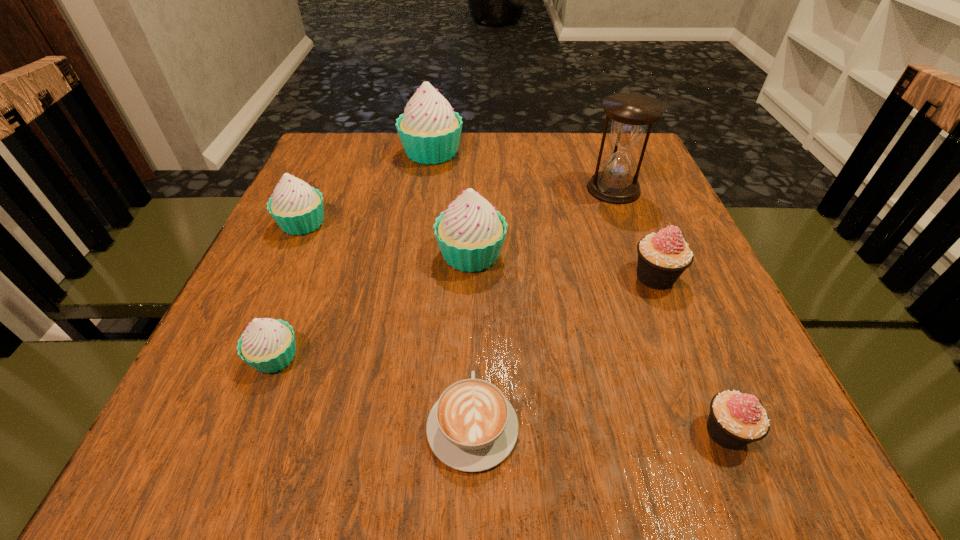
The image size is (960, 540). In the image, there is a desktop. Identify the location of blank space at the near edge. (372, 434).

Image resolution: width=960 pixels, height=540 pixels. Find the location of `free location at the left edge`. free location at the left edge is located at coordinates (235, 318).

Locate an element on the screen. Image resolution: width=960 pixels, height=540 pixels. vacant region at the right edge of the desktop is located at coordinates (741, 334).

The width and height of the screenshot is (960, 540). I want to click on vacant space at the far left corner of the desktop, so [327, 155].

This screenshot has height=540, width=960. In order to click on free space at the near left corner in this screenshot , I will do `click(275, 447)`.

Identify the location of vacant space at the far right corner of the desktop. (604, 152).

Find the location of a particular element. The width and height of the screenshot is (960, 540). blank region between the smaller pink cupcake and the cappuccino is located at coordinates (599, 429).

Where is `free space between the second tallest cupcake and the shortest object`? The height and width of the screenshot is (540, 960). free space between the second tallest cupcake and the shortest object is located at coordinates (471, 340).

The width and height of the screenshot is (960, 540). I want to click on vacant space that is in between the farthest object and the cappuccino, so click(x=452, y=289).

Locate an element on the screen. free space between the cappuccino and the farther pink cupcake is located at coordinates (564, 351).